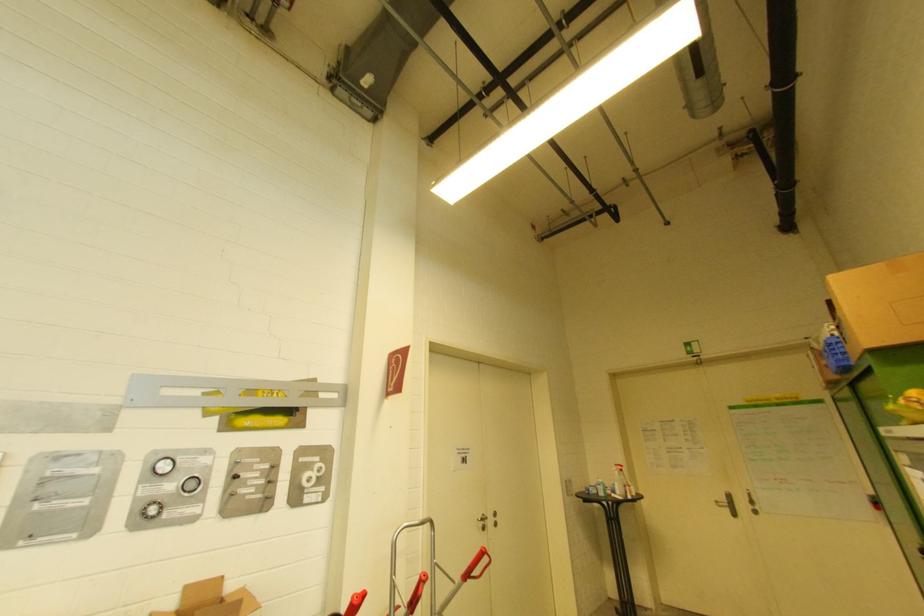
Image resolution: width=924 pixels, height=616 pixels. Describe the element at coordinates (727, 504) in the screenshot. I see `a silver door handle` at that location.